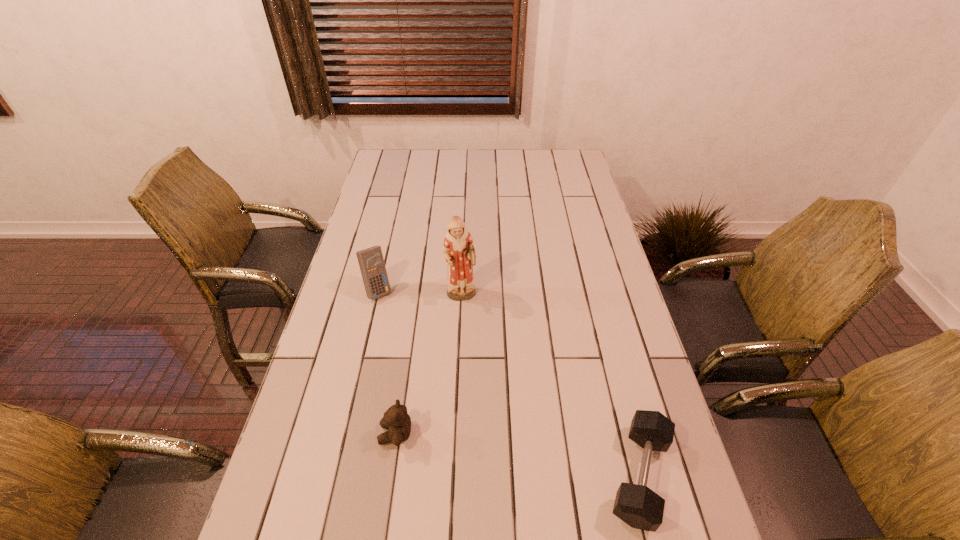
At what (x,y) coordinates should I click in order to perform the action: click on object at the right edge. Please return your answer as a coordinate pair (x, y). Looking at the image, I should click on click(638, 506).

The width and height of the screenshot is (960, 540). Identify the location of object located in the near right corner section of the desktop. (638, 506).

Image resolution: width=960 pixels, height=540 pixels. Identify the location of vacant space at the far edge of the desktop. (470, 149).

The height and width of the screenshot is (540, 960). I want to click on vacant space at the near edge of the desktop, so (594, 536).

At what (x,y) coordinates should I click in order to perform the action: click on vacant region at the left edge of the desktop. Please return your answer as a coordinate pair (x, y). The height and width of the screenshot is (540, 960). Looking at the image, I should click on (398, 237).

Identify the location of blank space at the right edge of the desktop. (574, 224).

In the image, there is a desktop. At what (x,y) coordinates should I click in order to perform the action: click on free space at the far left corner. Please return your answer as a coordinate pair (x, y). This screenshot has width=960, height=540. Looking at the image, I should click on (374, 174).

The width and height of the screenshot is (960, 540). I want to click on blank space at the far right corner of the desktop, so coord(560,167).

At what (x,y) coordinates should I click in order to perform the action: click on vacant space that's between the teddy bear and the figurine. Please return your answer as a coordinate pair (x, y). Image resolution: width=960 pixels, height=540 pixels. Looking at the image, I should click on (428, 365).

Find the location of `free space between the leftmost object and the dumbbell`. free space between the leftmost object and the dumbbell is located at coordinates (509, 383).